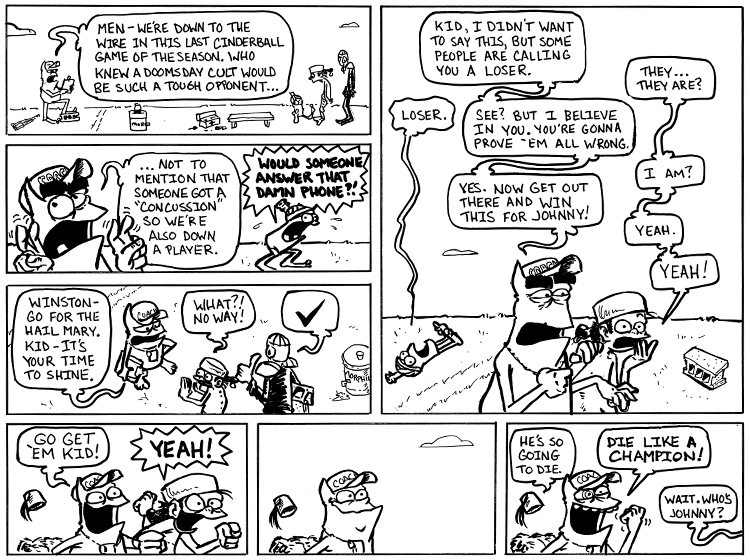
Locate an element on the screen. panel is located at coordinates (414, 70), (312, 36), (248, 238), (450, 476), (584, 451), (238, 456).